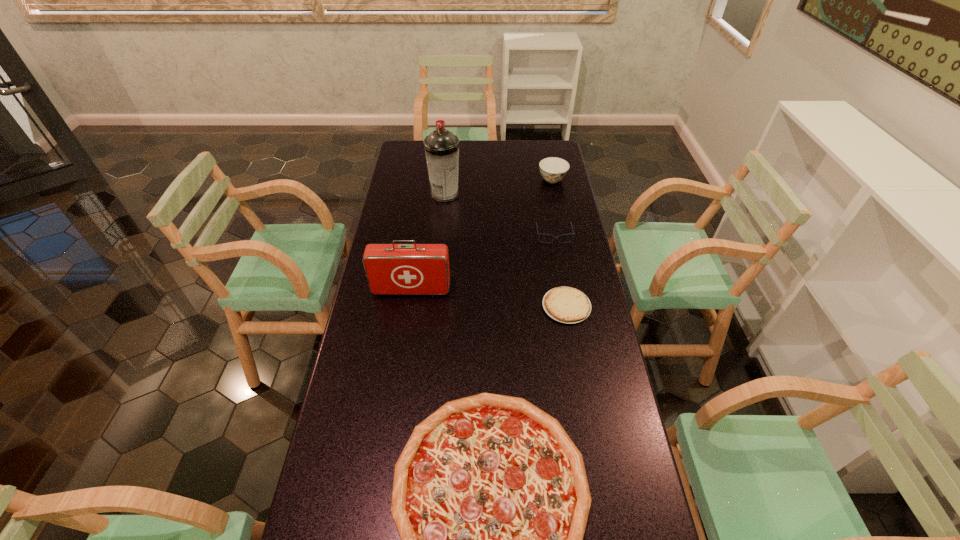
Identify the location of aerosol can. The width and height of the screenshot is (960, 540). (441, 146).

Image resolution: width=960 pixels, height=540 pixels. In order to click on the first-aid kit in this screenshot , I will do `click(391, 269)`.

Image resolution: width=960 pixels, height=540 pixels. Find the location of `the fourth shortest object`. the fourth shortest object is located at coordinates (553, 169).

This screenshot has height=540, width=960. What are the coordinates of `spectacles` in the screenshot? It's located at (538, 234).

The image size is (960, 540). Identify the location of the fourth tallest object. (538, 234).

Find the location of a particular element. tortilla is located at coordinates (568, 305).

Image resolution: width=960 pixels, height=540 pixels. I want to click on vacant area located 0.210m on the back of the tallest object, so click(448, 159).

At what (x,y) coordinates should I click in order to perform the action: click on free space located 0.340m on the side of the first-aid kit with the first aid cross symbol. Please return your answer as a coordinate pair (x, y). Looking at the image, I should click on (397, 387).

Where is `vacant space situated on the back of the soup bowl`? vacant space situated on the back of the soup bowl is located at coordinates (546, 146).

You are a GUI agent. You are given a task and a screenshot of the screen. Output one action in this format:
    pyautogui.click(x=<x>, y=<y>)
    Task: Click on the vacant area situated on the front-facing side of the fourth tallest object
    The width and height of the screenshot is (960, 540).
    Given the screenshot: What is the action you would take?
    pyautogui.click(x=565, y=304)